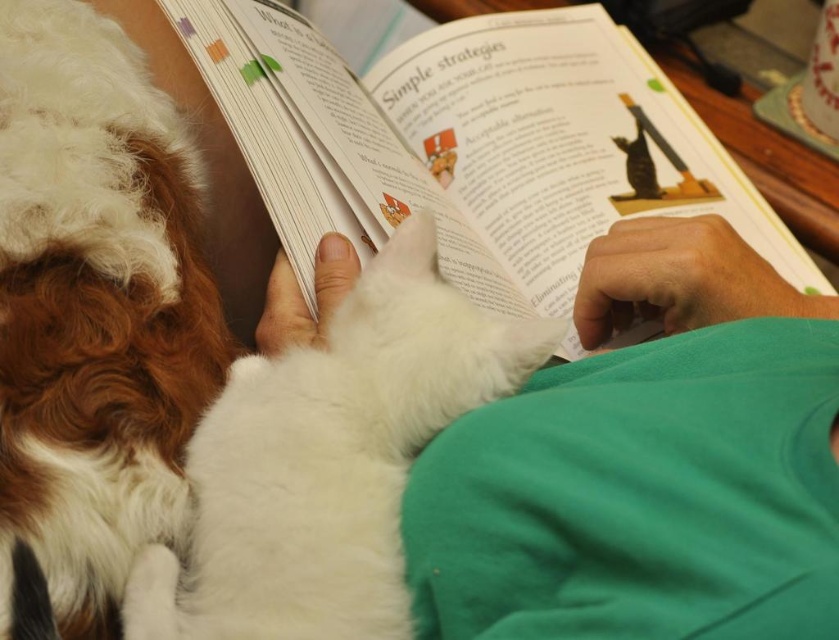
Is brown and white fur at left above white fluffy cat at center?

Correct, brown and white fur at left is located above white fluffy cat at center.

Does brown and white fur at left have a smaller size compared to white fluffy cat at center?

Incorrect, brown and white fur at left is not smaller in size than white fluffy cat at center.

You are a GUI agent. You are given a task and a screenshot of the screen. Output one action in this format:
    pyautogui.click(x=<x>, y=<y>)
    Task: Click on the brown and white fur at left
    Image resolution: width=839 pixels, height=640 pixels.
    Given the screenshot: What is the action you would take?
    pyautogui.click(x=95, y=307)

Between brown and white fur at left and white fur cat at center, which one has more height?

Standing taller between the two is brown and white fur at left.

Is point (38, 380) less distant than point (684, 604)?

That is False.

Between point (103, 545) and point (608, 541), which one is positioned behind?

The point (103, 545) is behind.

What are the coordinates of `brown and white fur at left` in the screenshot? It's located at (95, 307).

Can you confirm if white paper at center is thinner than white fluffy cat at center?

No, white paper at center is not thinner than white fluffy cat at center.

In the scene shown: Who is more forward, (280, 147) or (362, 476)?

Point (362, 476) is in front.

Who is more forward, (206, 61) or (352, 417)?

Point (352, 417)

Image resolution: width=839 pixels, height=640 pixels. Identify the location of white paper at center. click(472, 144).